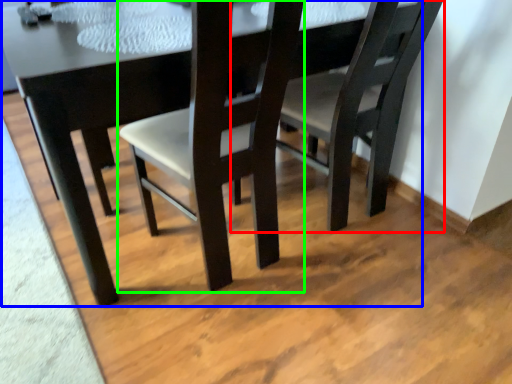
Question: Which is farther away from chair (highlighted by a red box)? table (highlighted by a blue box) or chair (highlighted by a green box)?

Choices:
 (A) table
 (B) chair

Answer: (A)